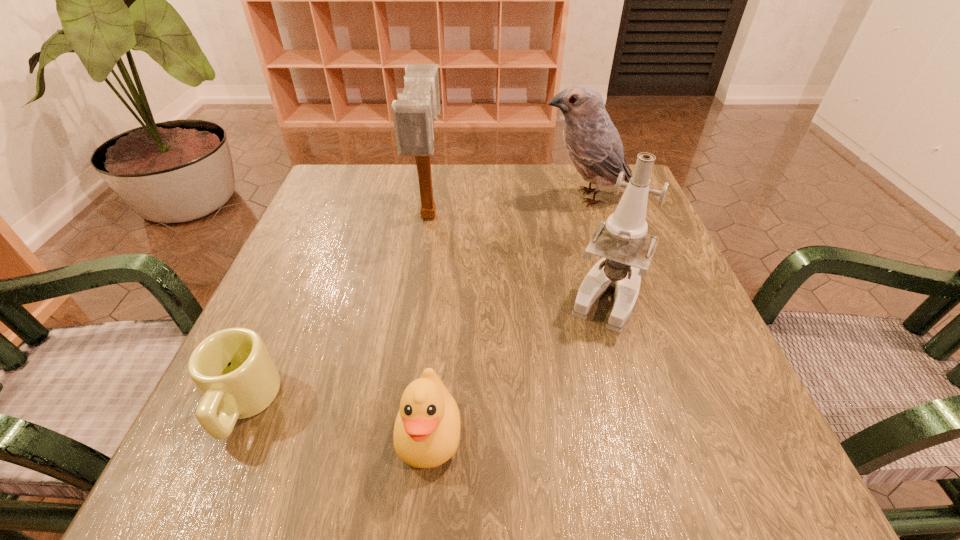
Image resolution: width=960 pixels, height=540 pixels. In order to click on vacant space at the far edge in this screenshot , I will do `click(439, 185)`.

Locate an element on the screen. vacant space at the left edge of the desktop is located at coordinates point(332,254).

In the image, there is a desktop. Find the location of `vacant space at the right edge`. vacant space at the right edge is located at coordinates (674, 252).

At what (x,y) coordinates should I click in order to perform the action: click on free space at the far left corner of the desktop. Please return your answer as a coordinate pair (x, y). This screenshot has width=960, height=540. Looking at the image, I should click on (326, 184).

The width and height of the screenshot is (960, 540). Identify the location of vacant area at the far right corner of the desktop. (601, 197).

Image resolution: width=960 pixels, height=540 pixels. I want to click on vacant space at the near right corner of the desktop, so click(x=669, y=464).

This screenshot has width=960, height=540. In order to click on vacant space in between the duck and the parrot in this screenshot , I will do `click(508, 315)`.

Find the location of a particular element. This screenshot has height=540, width=960. vacant space that is in between the mallet and the second shortest object is located at coordinates (429, 324).

Identify the location of empty space that is in between the parrot and the mallet. (507, 206).

The width and height of the screenshot is (960, 540). Find the location of `vacant space in between the duck and the mug`. vacant space in between the duck and the mug is located at coordinates (336, 418).